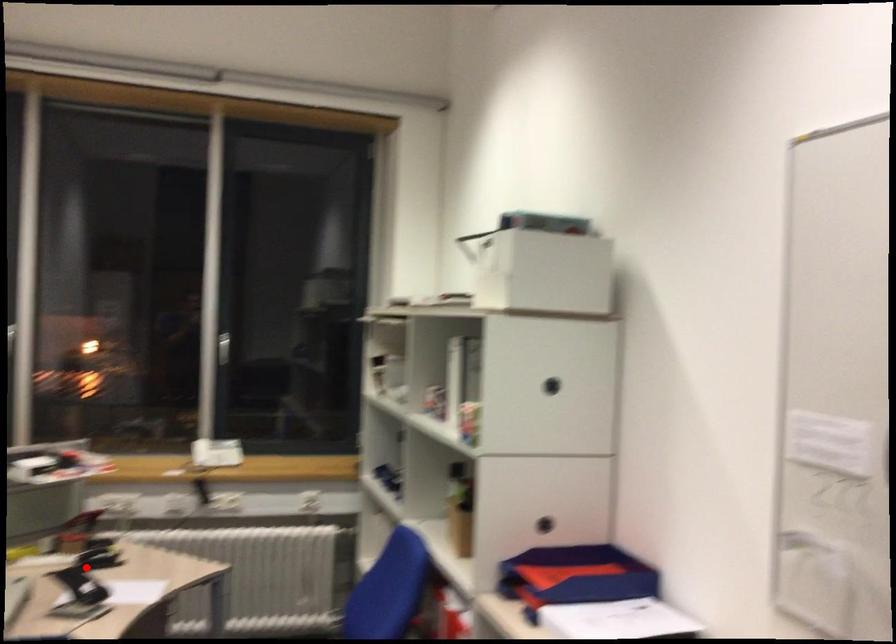
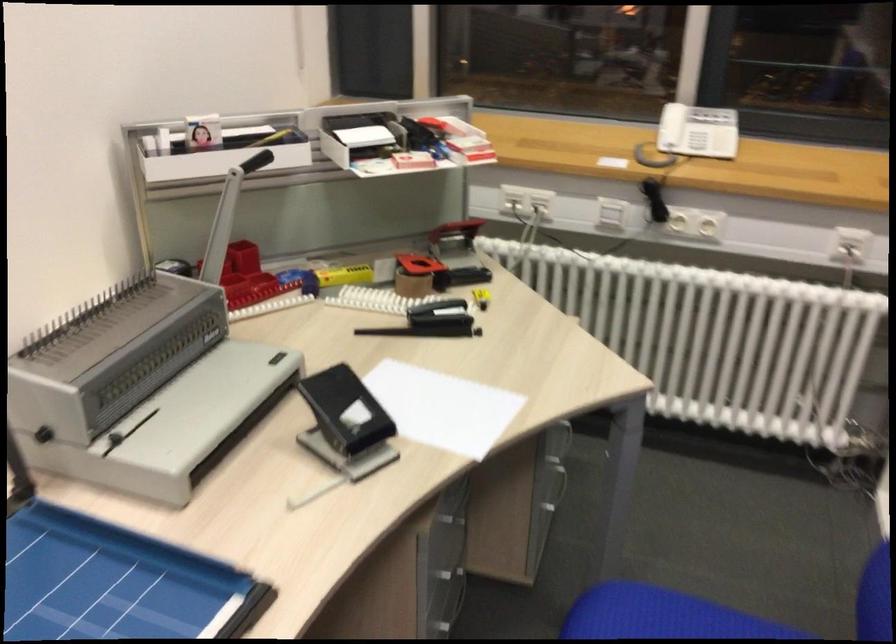
Question: I am providing you with two images of the same scene from different viewpoints. Given a red point in image1, look at the same physical point in image2. Is it:

Choices:
 (A) Closer to the viewpoint
 (B) Farther from the viewpoint

Answer: (A)